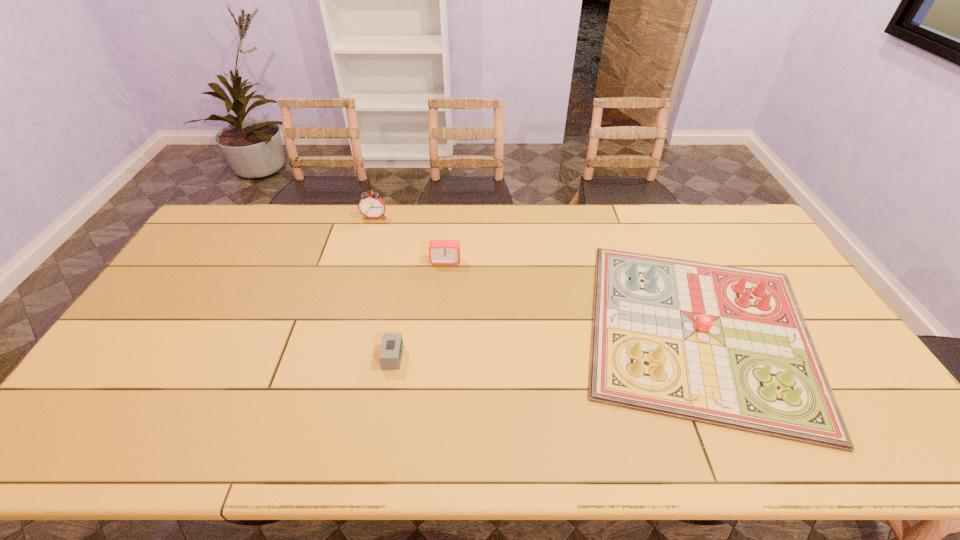
The height and width of the screenshot is (540, 960). What are the coordinates of `vacant region located on the left of the rightmost object` in the screenshot? It's located at (529, 330).

Identify the location of vacant space located on the front-facing side of the second alarm clock from left to right. (468, 357).

I want to click on object that is positioned at the far edge, so click(x=371, y=205).

Find the location of a particular element. object that is at the near edge is located at coordinates (727, 346).

Where is `object that is at the right edge`? object that is at the right edge is located at coordinates 727,346.

Where is `object located in the near right corner section of the desktop`? The width and height of the screenshot is (960, 540). object located in the near right corner section of the desktop is located at coordinates (727, 346).

In the image, there is a desktop. Identify the location of free region at the far edge. (457, 225).

In the image, there is a desktop. At what (x,y) coordinates should I click in order to perform the action: click on free space at the near edge. Please return your answer as a coordinate pair (x, y). Image resolution: width=960 pixels, height=540 pixels. Looking at the image, I should click on [539, 444].

Image resolution: width=960 pixels, height=540 pixels. I want to click on vacant region at the left edge of the desktop, so click(141, 374).

At what (x,y) coordinates should I click in order to perform the action: click on vacant space at the right edge of the desktop. Please return your answer as a coordinate pair (x, y). Image resolution: width=960 pixels, height=540 pixels. Looking at the image, I should click on (844, 361).